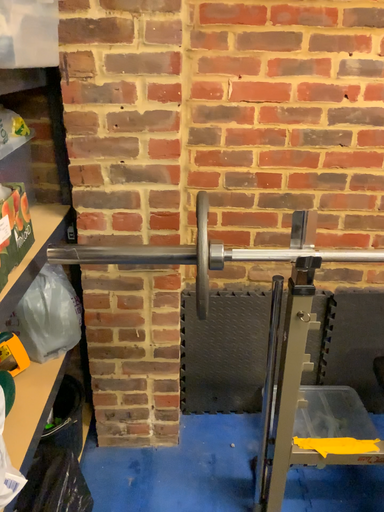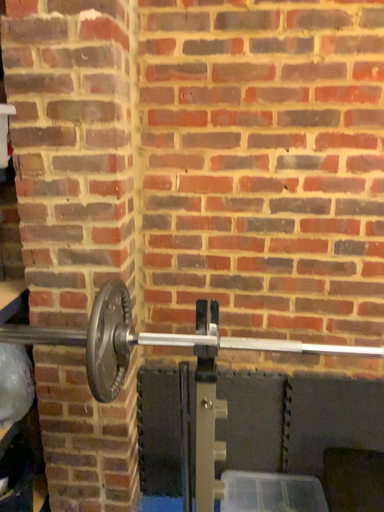
Question: How did the camera likely rotate when shooting the video?

Choices:
 (A) rotated downward
 (B) rotated upward

Answer: (B)